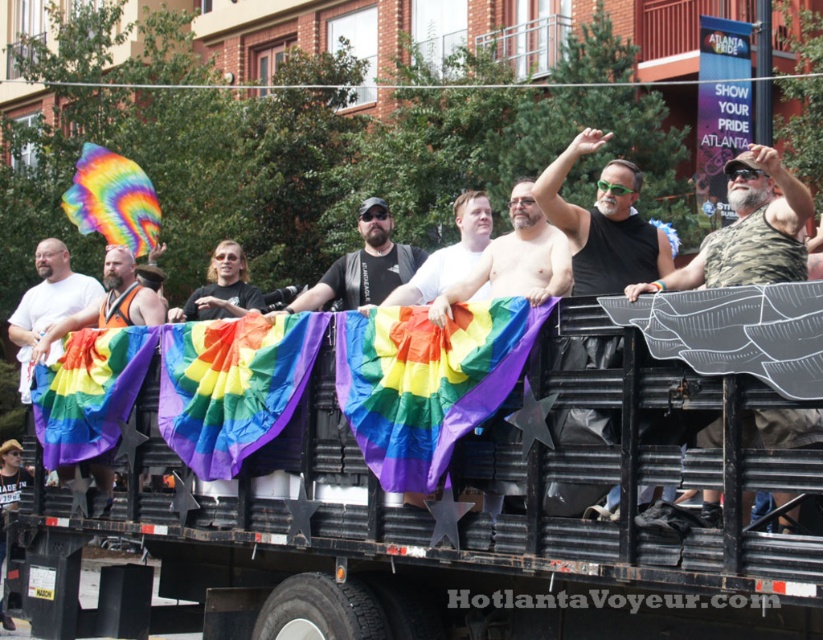
You are a photographer positioned at the center of the scene. You want to capture the black corrugated metal truck at center in your shot. Based on its location coordinates, is the truck positioned more towards the left or right side of the frame?

The black corrugated metal truck at center is located at point 0.762 on the x axis, which is closer to the right side of the frame since the coordinate system typically ranges from 0 to 1. Therefore, the truck is positioned more towards the right side of the frame.

You are a photographer trying to capture the rainbow flags on the truck bed. You notice a point marked at coordinates (454, 486) in the image. Based on the scene description, can you determine if this point is located on the rainbow flags or on the truck itself?

The point at coordinates (454, 486) is on the black corrugated metal truck at center, not on the rainbow flags.

You are a photographer standing in front of the black truck at the Pride parade. You want to take a photo that includes both the point at coordinates point (373, 198) and point (398, 301). Since you need to focus on the closer object, which point should you focus on?

Point (398, 301) is closer to you than point (373, 198), so you should focus on point (398, 301) to ensure the closer object is in focus.